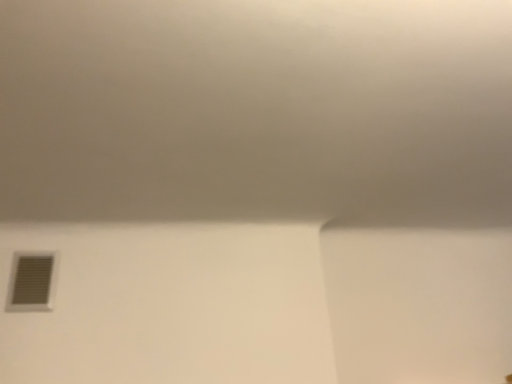
The width and height of the screenshot is (512, 384). Find the location of `matte gray vent at lower left`. matte gray vent at lower left is located at coordinates (31, 283).

The width and height of the screenshot is (512, 384). What do you see at coordinates (31, 283) in the screenshot?
I see `matte gray vent at lower left` at bounding box center [31, 283].

Identify the location of matte gray vent at lower left. (31, 283).